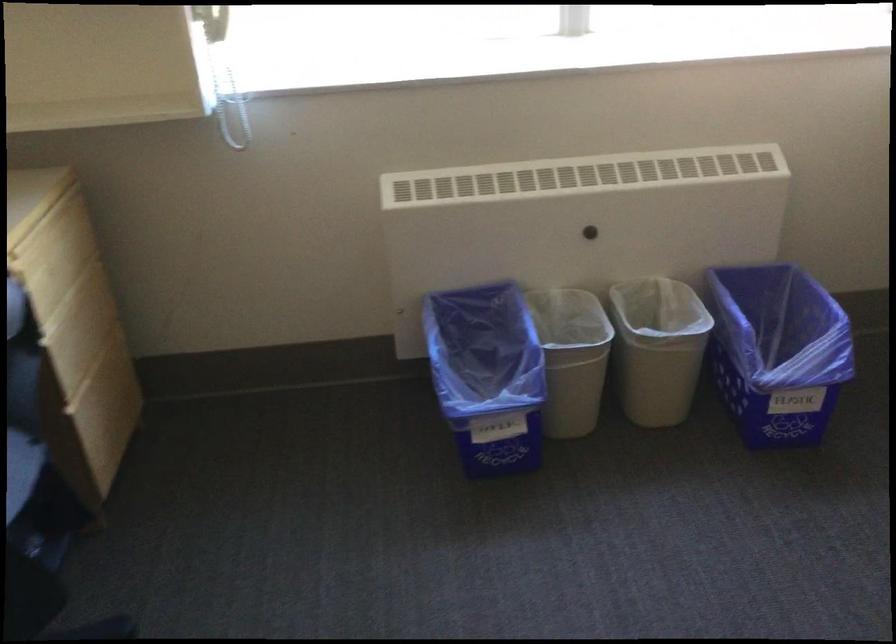
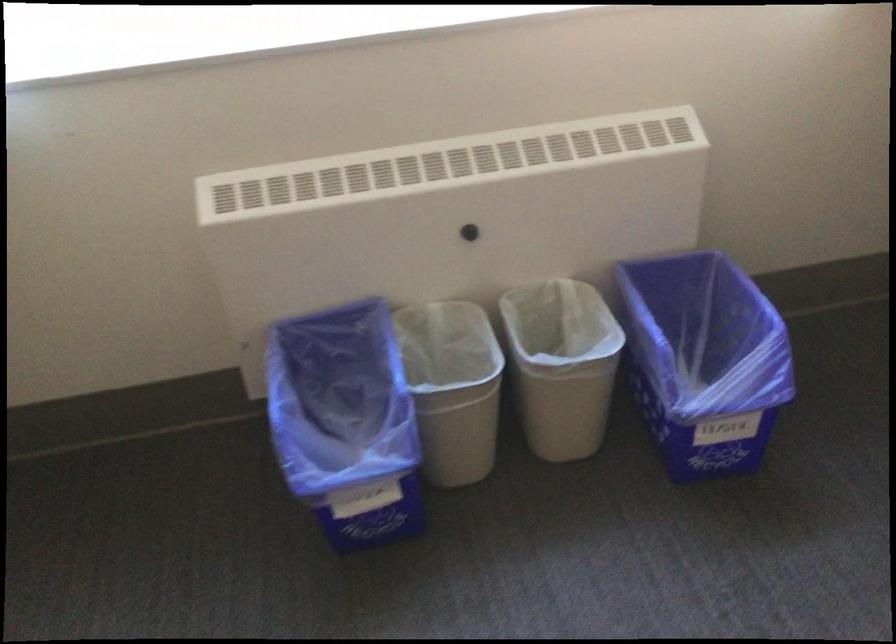
The point at (779, 339) is marked in the first image. Where is the corresponding point in the second image?

(702, 339)